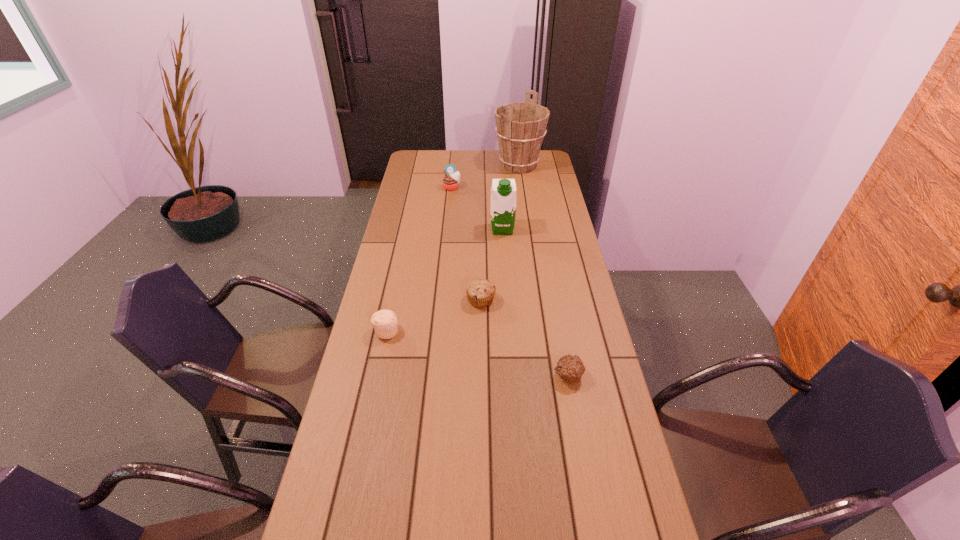
In order to click on bucket in this screenshot , I will do `click(520, 126)`.

Find the location of a particular element. This screenshot has width=960, height=540. the farthest object is located at coordinates (520, 126).

In order to click on soya milk in this screenshot , I will do `click(503, 191)`.

Find the location of a particular element. the third farthest object is located at coordinates (503, 191).

At what (x,y) coordinates should I click in order to perform the action: click on the fifth nearest object. Please return your answer as a coordinate pair (x, y). Image resolution: width=960 pixels, height=540 pixels. Looking at the image, I should click on (450, 182).

Locate an element on the screen. This screenshot has height=540, width=960. the second muffin from left to right is located at coordinates (450, 182).

In order to click on the fourth farthest object in this screenshot , I will do `click(480, 292)`.

Image resolution: width=960 pixels, height=540 pixels. Identify the location of the third muffin from left to right. (480, 292).

Locate an element on the screen. the third farthest muffin is located at coordinates (384, 322).

Identify the location of the second nearest object. This screenshot has width=960, height=540. (384, 322).